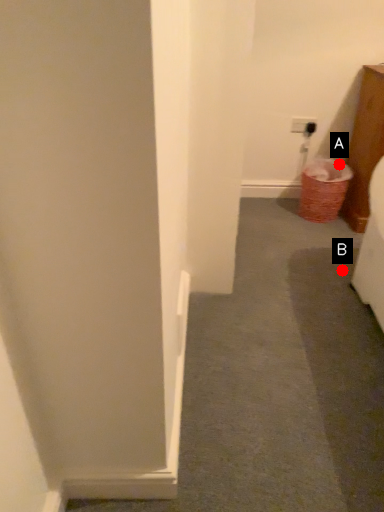
Question: Two points are circled on the image, labeled by A and B beside each circle. Which point appears farthest from the camera in this image?

Choices:
 (A) A is further
 (B) B is further

Answer: (A)